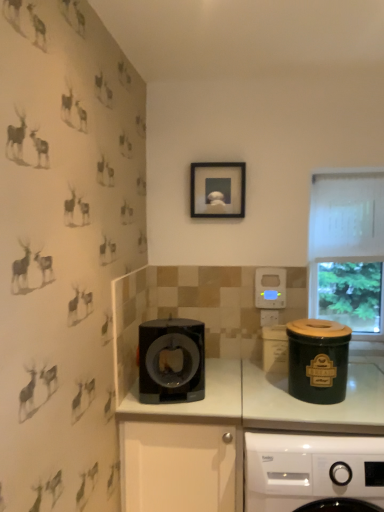
Question: Should I look upward or downward to see green ceramic canister at right?

Choices:
 (A) down
 (B) up

Answer: (A)

Question: Is black matte picture frame at upper center beside transparent glass window at upper right?

Choices:
 (A) no
 (B) yes

Answer: (A)

Question: From the image's perspective, is black matte picture frame at upper center under transparent glass window at upper right?

Choices:
 (A) no
 (B) yes

Answer: (A)

Question: Considering the relative positions of black matte picture frame at upper center and transparent glass window at upper right in the image provided, is black matte picture frame at upper center to the left of transparent glass window at upper right from the viewer's perspective?

Choices:
 (A) no
 (B) yes

Answer: (B)

Question: Is black matte picture frame at upper center not close to transparent glass window at upper right?

Choices:
 (A) no
 (B) yes

Answer: (A)

Question: From a real-world perspective, is black matte picture frame at upper center over transparent glass window at upper right?

Choices:
 (A) no
 (B) yes

Answer: (B)

Question: Is black matte picture frame at upper center bigger than transparent glass window at upper right?

Choices:
 (A) yes
 (B) no

Answer: (B)

Question: Is black plastic drawer at center positioned in front of green ceramic canister at right?

Choices:
 (A) yes
 (B) no

Answer: (A)

Question: Is black plastic drawer at center turned away from green ceramic canister at right?

Choices:
 (A) no
 (B) yes

Answer: (A)

Question: Is green ceramic canister at right surrounded by black plastic drawer at center?

Choices:
 (A) no
 (B) yes

Answer: (A)

Question: From a real-world perspective, is black plastic drawer at center on green ceramic canister at right?

Choices:
 (A) yes
 (B) no

Answer: (B)

Question: Is there a large distance between black plastic drawer at center and green ceramic canister at right?

Choices:
 (A) no
 (B) yes

Answer: (A)

Question: Is black plastic drawer at center oriented towards green ceramic canister at right?

Choices:
 (A) no
 (B) yes

Answer: (A)

Question: Does black plastic drawer at center lie behind black matte picture frame at upper center?

Choices:
 (A) yes
 (B) no

Answer: (B)